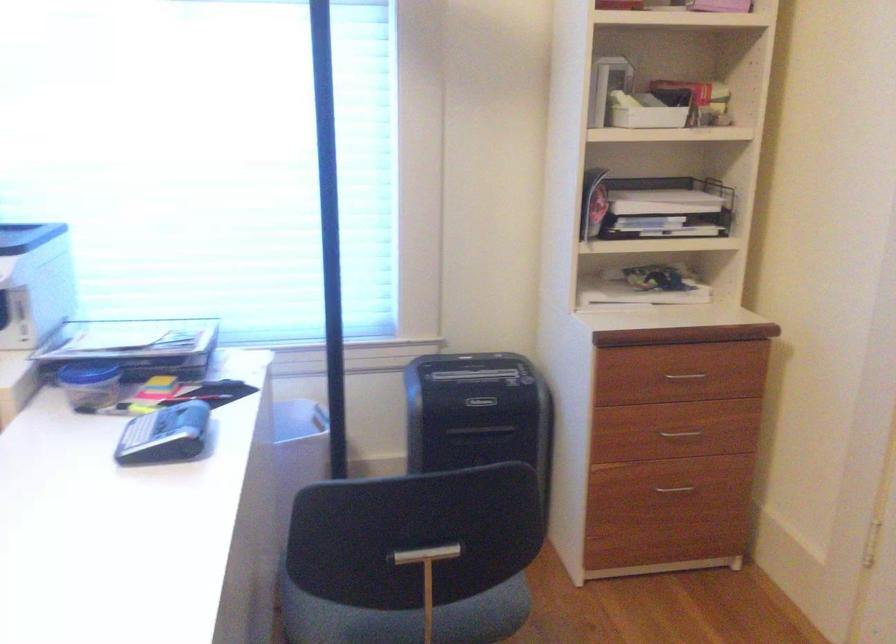
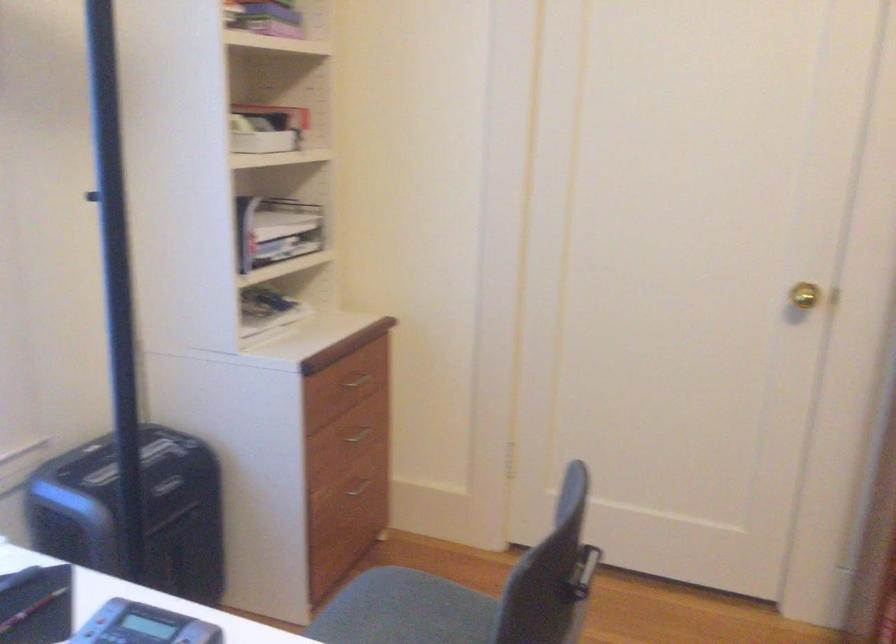
Question: How did the camera likely rotate?

Choices:
 (A) Left
 (B) Right
 (C) Up
 (D) Down

Answer: (B)